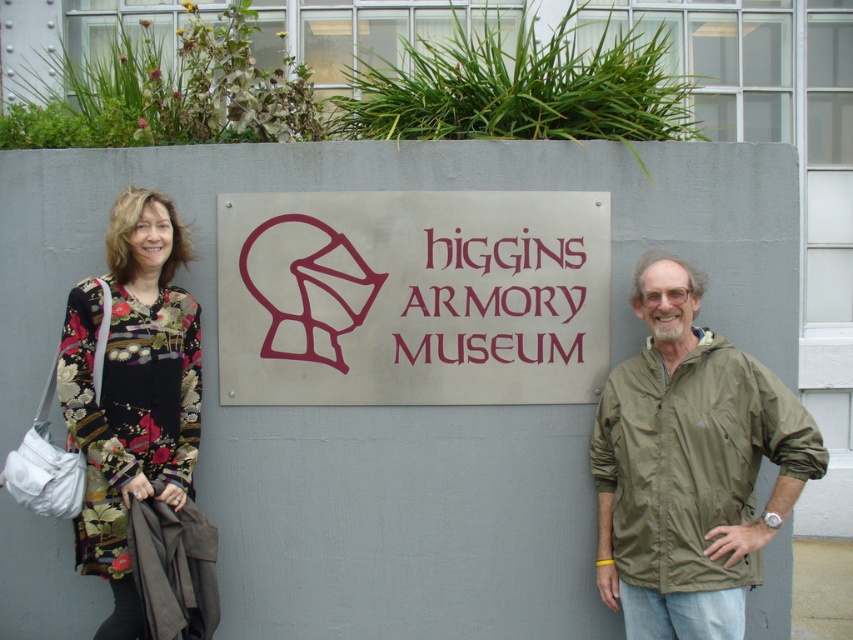
Question: Is satin silver sign at center behind olive green jacket at right?

Choices:
 (A) yes
 (B) no

Answer: (A)

Question: Which of the following is the closest to the observer?

Choices:
 (A) matte metal sign at center
 (B) floral-patterned fabric at left
 (C) olive green jacket at right

Answer: (C)

Question: From the image, what is the correct spatial relationship of olive green jacket at right in relation to floral-patterned fabric dress at left?

Choices:
 (A) left
 (B) right

Answer: (B)

Question: Does satin silver sign at center appear on the right side of floral-patterned fabric dress at left?

Choices:
 (A) no
 (B) yes

Answer: (B)

Question: Which point is farther from the camera taking this photo?

Choices:
 (A) (x=102, y=422)
 (B) (x=412, y=202)
 (C) (x=500, y=312)

Answer: (C)

Question: Considering the real-world distances, which object is closest to the satin silver sign at center?

Choices:
 (A) olive green jacket at right
 (B) floral-patterned fabric dress at left

Answer: (B)